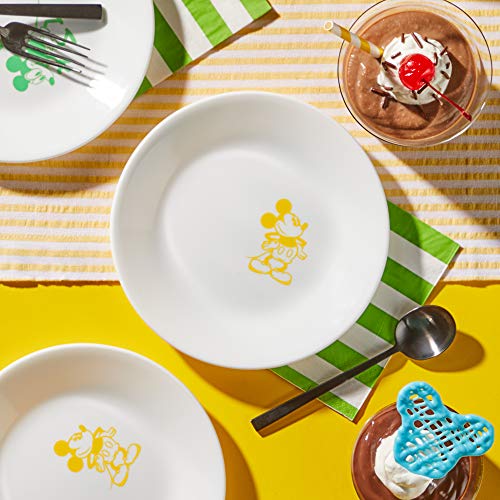
Locate an element on the screen. The width and height of the screenshot is (500, 500). white dishes is located at coordinates (142, 419), (194, 269), (69, 129).